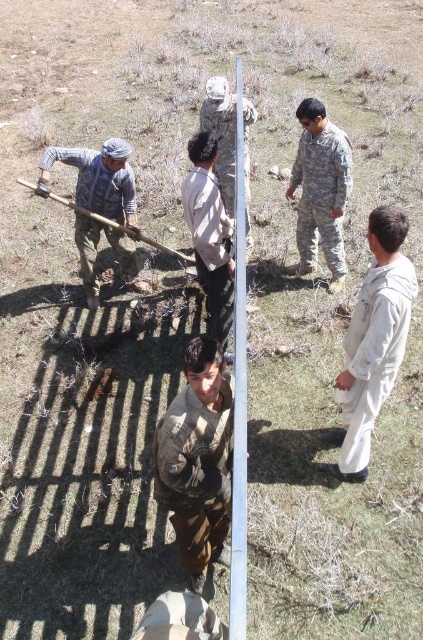
Based on the scene description, can you determine the spatial relationship between the white matte uniform at right and the camouflage fabric soldier at center?

The white matte uniform at right is positioned to the right of the camouflage fabric soldier at center.

You are a construction worker trying to decide which object to use for digging. You see the camouflage fabric soldier at center and the wooden shovel at left. Which object is more suitable for digging?

The wooden shovel at left is more suitable for digging because it is thicker than the camouflage fabric soldier at center.